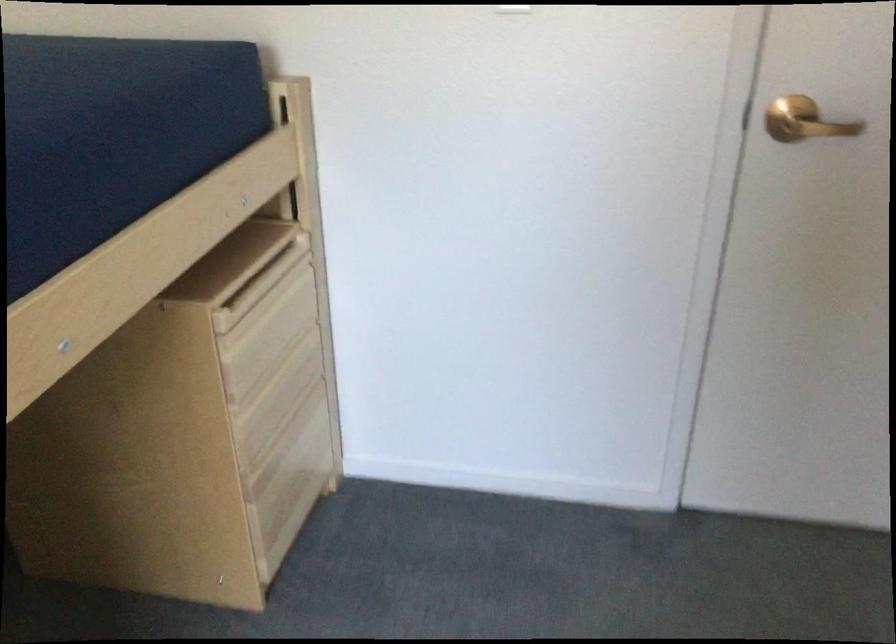
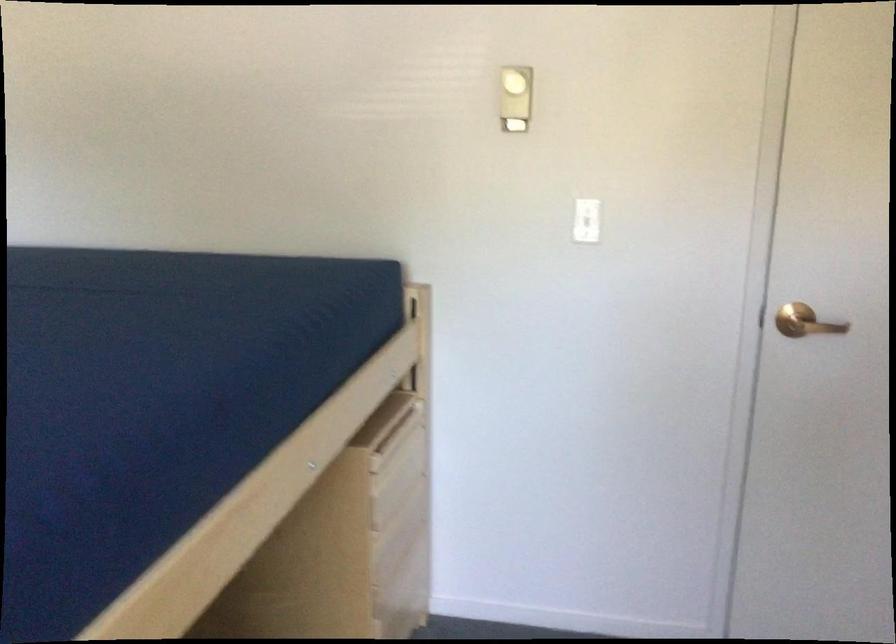
Find the pixel in the second image that matches [271,269] in the first image.

(399, 429)